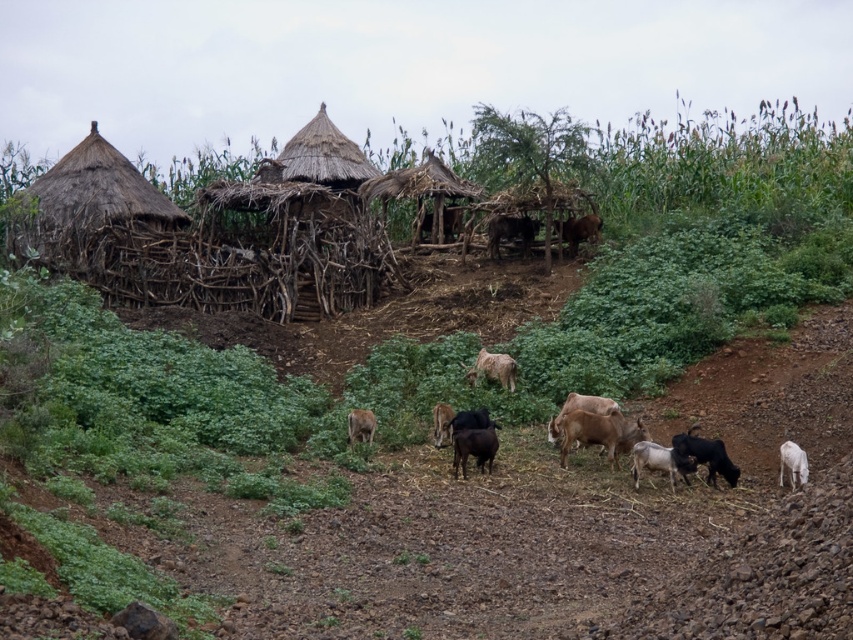
Question: Does thatched wood huts at upper left appear under brown fur goat at center?

Choices:
 (A) yes
 (B) no

Answer: (B)

Question: Which point is closer to the camera?

Choices:
 (A) white woolen goat at lower right
 (B) brown furry goat at center
 (C) thatched straw hut at left
 (D) black woolen goat at center

Answer: (A)

Question: Can you confirm if thatched straw hut at left is smaller than brown woolly goat at center?

Choices:
 (A) yes
 (B) no

Answer: (B)

Question: Which of these objects is positioned farthest from the black woolly goat at center?

Choices:
 (A) thatched straw hut at left
 (B) black woolen goat at lower right
 (C) brown fur goat at center

Answer: (A)

Question: Which object is the closest to the black woolen goat at lower right?

Choices:
 (A) brown furry goat at center
 (B) white woolly sheep at center

Answer: (B)

Question: Does thatched straw hut at left have a greater width compared to white woolly sheep at center?

Choices:
 (A) no
 (B) yes

Answer: (B)